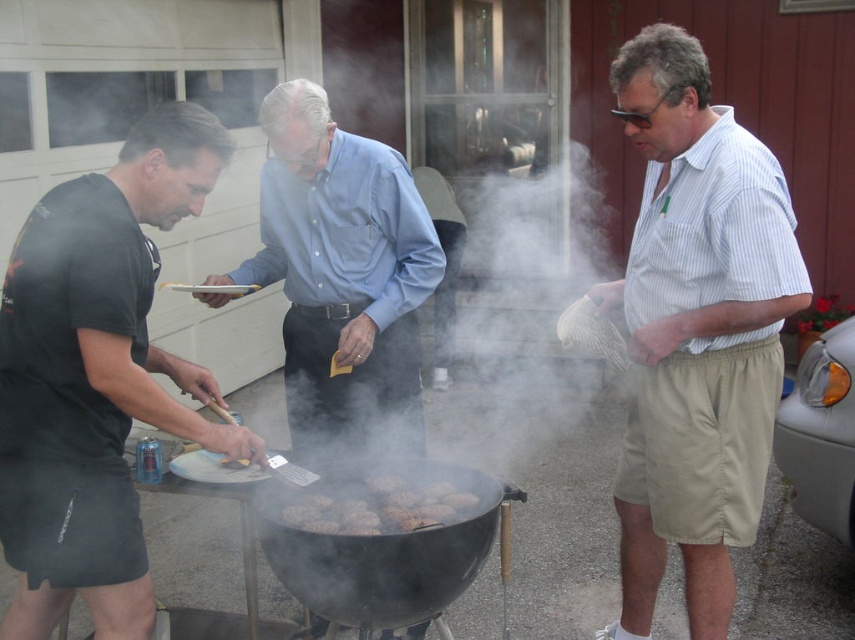
Question: Can you confirm if black matte barbecue grill at center is wider than brown crispy burger patties at center?

Choices:
 (A) yes
 (B) no

Answer: (A)

Question: Can you confirm if black matte t-shirt at left is wider than black matte barbecue grill at center?

Choices:
 (A) no
 (B) yes

Answer: (A)

Question: Which of the following is the closest to the observer?

Choices:
 (A) blue cotton shirt at center
 (B) brown crispy burger patties at center
 (C) black matte barbecue grill at center
 (D) black matte t-shirt at left

Answer: (D)

Question: Which point is closer to the camera?

Choices:
 (A) blue cotton shirt at center
 (B) black matte t-shirt at left
 (C) black matte barbecue grill at center
 (D) brown crispy burger patties at center

Answer: (B)

Question: Is white striped shirt at center in front of blue cotton shirt at center?

Choices:
 (A) no
 (B) yes

Answer: (B)

Question: Which point is closer to the camera?

Choices:
 (A) black matte barbecue grill at center
 (B) brown crispy burger patties at center
 (C) blue cotton shirt at center

Answer: (A)